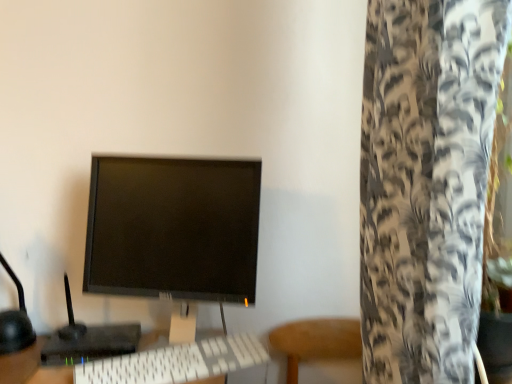
Where is `white plastic keyboard at center`? The image size is (512, 384). white plastic keyboard at center is located at coordinates (177, 362).

This screenshot has width=512, height=384. Describe the element at coordinates (177, 362) in the screenshot. I see `white plastic keyboard at center` at that location.

Find the location of a particular element. The height and width of the screenshot is (384, 512). black plastic monitor at center is located at coordinates (88, 340).

Considering the sizes of objects white plastic keyboard at center and black plastic monitor at center in the image provided, who is bigger, white plastic keyboard at center or black plastic monitor at center?

black plastic monitor at center.

From the image's perspective, is white plastic keyboard at center beneath black plastic monitor at center?

Yes, from the image's perspective, white plastic keyboard at center is beneath black plastic monitor at center.

From a real-world perspective, is white plastic keyboard at center positioned above or below black plastic monitor at center?

Clearly, from a real-world perspective, white plastic keyboard at center is below black plastic monitor at center.

Does white plastic keyboard at center touch black plastic monitor at center?

white plastic keyboard at center and black plastic monitor at center are clearly separated.

Considering the relative sizes of black plastic monitor at center and white plastic keyboard at center in the image provided, is black plastic monitor at center shorter than white plastic keyboard at center?

No.

Where is `computer keyboard below the black plastic monitor at center (from the image's perspective)`? computer keyboard below the black plastic monitor at center (from the image's perspective) is located at coordinates (177, 362).

Is black plastic monitor at center not within white plastic keyboard at center?

black plastic monitor at center lies outside white plastic keyboard at center's area.

Which object is positioned more to the left, black plastic monitor at center or white plastic keyboard at center?

From the viewer's perspective, black plastic monitor at center appears more on the left side.

Is white textured curtain at right not within black plastic monitor at center?

Yes, white textured curtain at right is not within black plastic monitor at center.

Is white textured curtain at right to the left or to the right of black plastic monitor at center in the image?

In the image, white textured curtain at right appears on the right side of black plastic monitor at center.

In terms of width, does white textured curtain at right look wider or thinner when compared to black plastic monitor at center?

In the image, white textured curtain at right appears to be wider than black plastic monitor at center.

Does white textured curtain at right touch black plastic monitor at center?

white textured curtain at right and black plastic monitor at center are clearly separated.

Is black plastic monitor at center facing away from white textured curtain at right?

No, black plastic monitor at center is not facing the opposite direction of white textured curtain at right.

Is the position of black plastic monitor at center more distant than that of white textured curtain at right?

Yes, black plastic monitor at center is behind white textured curtain at right.

Considering the positions of objects black plastic monitor at center and white textured curtain at right in the image provided, who is more to the left, black plastic monitor at center or white textured curtain at right?

black plastic monitor at center.

Is white textured curtain at right closer to camera compared to black matte monitor at center?

Yes, white textured curtain at right is in front of black matte monitor at center.

Is white textured curtain at right wider or thinner than black matte monitor at center?

Clearly, white textured curtain at right has more width compared to black matte monitor at center.

Who is bigger, white textured curtain at right or black matte monitor at center?

white textured curtain at right.

From a real-world perspective, is white textured curtain at right above or below black matte monitor at center?

From a real-world perspective, white textured curtain at right is physically above black matte monitor at center.

Considering the sizes of objects black matte monitor at center and black plastic monitor at center in the image provided, who is taller, black matte monitor at center or black plastic monitor at center?

black matte monitor at center is taller.

Does black matte monitor at center have a lesser width compared to black plastic monitor at center?

Yes, black matte monitor at center is thinner than black plastic monitor at center.

Is black matte monitor at center outside of black plastic monitor at center?

Yes, black matte monitor at center is located beyond the bounds of black plastic monitor at center.

Between black matte monitor at center and black plastic monitor at center, which one has smaller size?

Smaller between the two is black plastic monitor at center.

Is white plastic keyboard at center bigger than white textured curtain at right?

No.

How distant is white plastic keyboard at center from white textured curtain at right?

white plastic keyboard at center and white textured curtain at right are 22.06 inches apart from each other.

Is point (92, 370) positioned before point (497, 46)?

No, it is not.

From a real-world perspective, is white plastic keyboard at center under white textured curtain at right?

Yes.

Where is `computer keyboard below the black plastic monitor at center (from a real-world perspective)`? computer keyboard below the black plastic monitor at center (from a real-world perspective) is located at coordinates (177, 362).

The width and height of the screenshot is (512, 384). Identify the location of computer keyboard on the right of black plastic monitor at center. click(177, 362).

Considering their positions, is black plastic monitor at center positioned closer to black matte monitor at center than white textured curtain at right?

Based on the image, black plastic monitor at center appears to be nearer to black matte monitor at center.

Estimate the real-world distances between objects in this image. Which object is further from white plastic keyboard at center, black plastic monitor at center or white textured curtain at right?

white textured curtain at right is positioned further to the anchor white plastic keyboard at center.

Considering their positions, is black plastic monitor at center positioned further to white plastic keyboard at center than black matte monitor at center?

Among the two, black matte monitor at center is located further to white plastic keyboard at center.

Based on their spatial positions, is white textured curtain at right or black matte monitor at center further from black plastic monitor at center?

white textured curtain at right is positioned further to the anchor black plastic monitor at center.

When comparing their distances from black plastic monitor at center, does black matte monitor at center or white textured curtain at right seem further?

Based on the image, white textured curtain at right appears to be further to black plastic monitor at center.

Looking at the image, which one is located further to white plastic keyboard at center, white textured curtain at right or black matte monitor at center?

The object further to white plastic keyboard at center is white textured curtain at right.

Based on their spatial positions, is black plastic monitor at center or white plastic keyboard at center further from black matte monitor at center?

black plastic monitor at center is positioned further to the anchor black matte monitor at center.

Estimate the real-world distances between objects in this image. Which object is further from white plastic keyboard at center, white textured curtain at right or black plastic monitor at center?

Among the two, white textured curtain at right is located further to white plastic keyboard at center.

Where is `computer keyboard between black matte monitor at center and white textured curtain at right`? This screenshot has height=384, width=512. computer keyboard between black matte monitor at center and white textured curtain at right is located at coordinates (177, 362).

You are a GUI agent. You are given a task and a screenshot of the screen. Output one action in this format:
    pyautogui.click(x=<x>, y=<y>)
    Task: Click on the computer monitor situated between black plastic monitor at center and white plastic keyboard at center from left to right
    The height and width of the screenshot is (384, 512).
    Given the screenshot: What is the action you would take?
    pyautogui.click(x=173, y=228)

At what (x,y) coordinates should I click in order to perform the action: click on computer keyboard between black plastic monitor at center and white textured curtain at right. Please return your answer as a coordinate pair (x, y). Looking at the image, I should click on (177, 362).

Locate an element on the screen. This screenshot has width=512, height=384. computer monitor between black plastic monitor at center and white textured curtain at right is located at coordinates (173, 228).